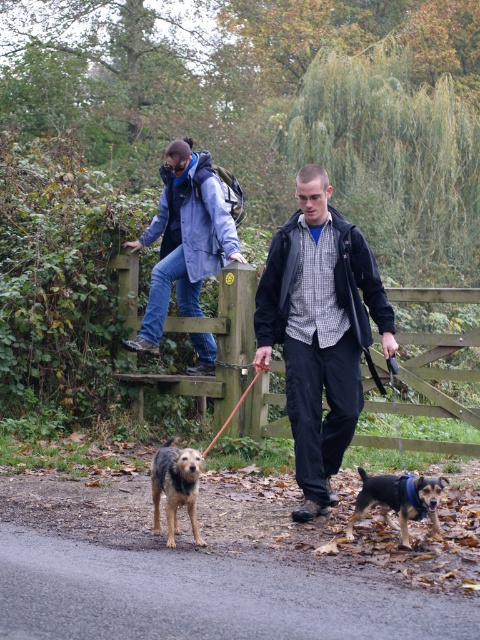
You are a dog owner trying to decide if your brown fur dog at lower center can comfortably walk under the red nylon leash at center without hitting its head. Based on the scene, can it?

The brown fur dog at lower center is not as tall as the red nylon leash at center, so it should be able to walk under the leash without hitting its head.

You are standing at the point marked as point (397,499) in the image. What do you see in the lower right direction from this point?

In the lower right direction from point (397,499), there is brown and black fur.

You are standing at the stile and want to determine which of the two points, point (21, 531) or point (312, 294), is closer to you. Based on the scene, which point is nearer?

Point (21, 531) is closer to the viewer than point (312, 294).